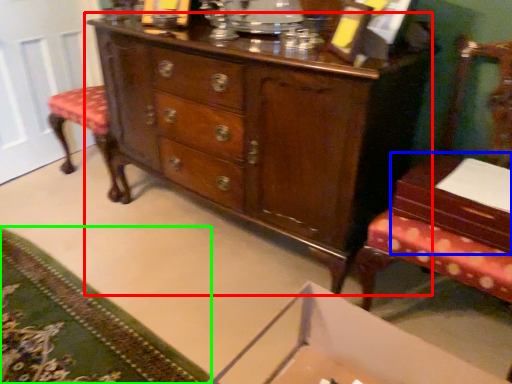
Question: Which object is the farthest from chest of drawers (highlighted by a red box)? Choose among these: table (highlighted by a blue box) or mat (highlighted by a green box).

Choices:
 (A) table
 (B) mat

Answer: (B)